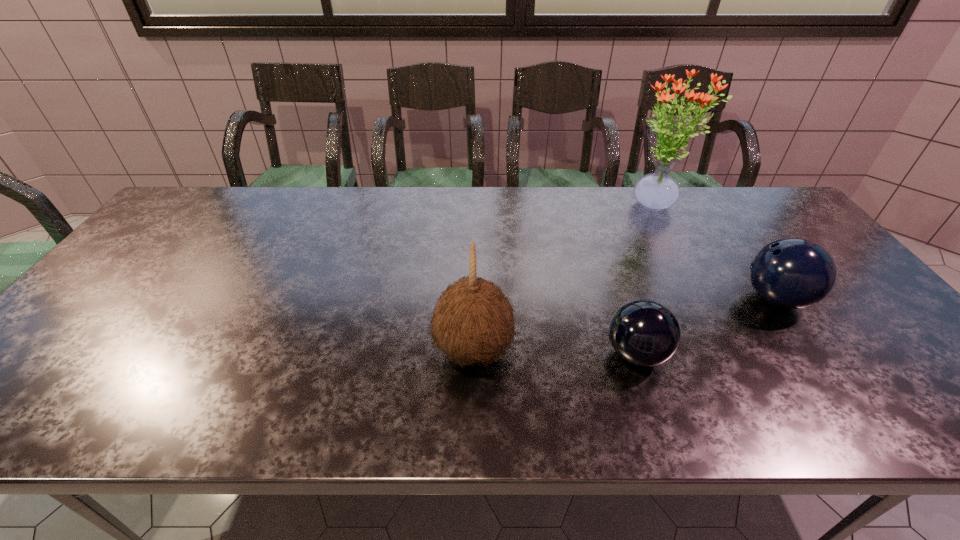
At what (x,y) coordinates should I click in order to perform the action: click on vacant space positioned 0.280m on the surface of the right bowling ball near the finger holes. Please return your answer as a coordinate pair (x, y). The width and height of the screenshot is (960, 540). Looking at the image, I should click on (633, 299).

Locate an element on the screen. free location located 0.250m on the surface of the right bowling ball near the finger holes is located at coordinates (645, 299).

Where is `free region located 0.390m on the surface of the right bowling ball near the finger holes`? This screenshot has height=540, width=960. free region located 0.390m on the surface of the right bowling ball near the finger holes is located at coordinates (590, 299).

The height and width of the screenshot is (540, 960). In order to click on vacant area situated 0.140m on the side of the shortest object with the finger holes in this screenshot , I will do `click(543, 354)`.

At what (x,y) coordinates should I click in order to perform the action: click on blank space located 0.400m on the side of the shortest object with the finger holes. Please return your answer as a coordinate pair (x, y). Image resolution: width=960 pixels, height=540 pixels. Looking at the image, I should click on (429, 354).

Where is `blank space located 0.190m on the side of the shortest object with the finger holes`? This screenshot has height=540, width=960. blank space located 0.190m on the side of the shortest object with the finger holes is located at coordinates (521, 354).

Identify the location of object situated at the far edge. (657, 191).

This screenshot has height=540, width=960. Identify the location of object that is at the right edge. (792, 273).

Identify the location of vacant space at the far edge of the desktop. pos(224,215).

What are the coordinates of `free space at the near edge of the desktop` in the screenshot? It's located at (464, 418).